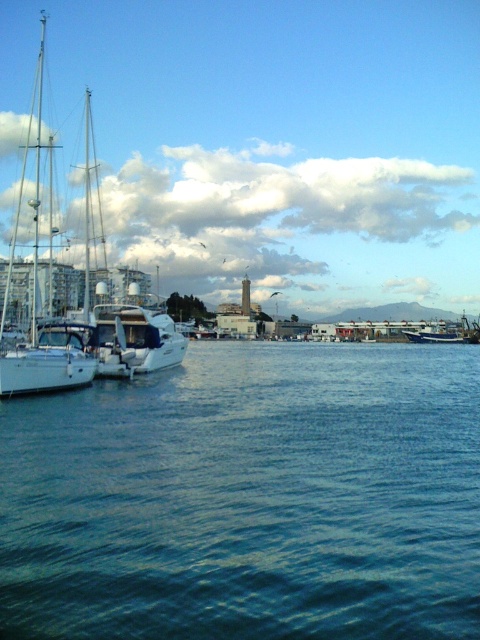
Question: Among these points, which one is farthest from the camera?

Choices:
 (A) (443, 340)
 (B) (470, 452)
 (C) (6, 364)

Answer: (A)

Question: Does blue water at lower left appear under white glossy sailboat at left?

Choices:
 (A) yes
 (B) no

Answer: (A)

Question: Does white glossy sailboat at left appear over blue matte boat at center?

Choices:
 (A) no
 (B) yes

Answer: (B)

Question: Is white glossy sailboat at left below blue matte boat at center?

Choices:
 (A) no
 (B) yes

Answer: (A)

Question: Which object is the farthest from the blue water at lower left?

Choices:
 (A) blue matte boat at center
 (B) white glossy sailboat at left

Answer: (A)

Question: Among these points, which one is farthest from the camera?

Choices:
 (A) (196, 547)
 (B) (420, 332)
 (C) (39, 115)

Answer: (C)